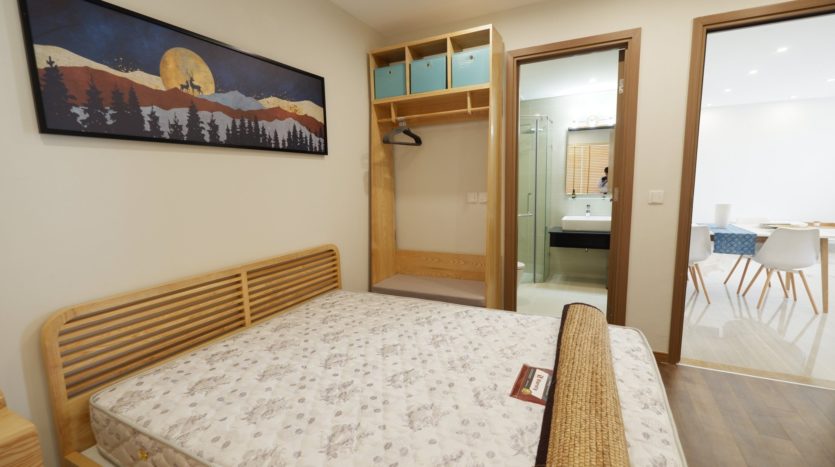
Image resolution: width=835 pixels, height=467 pixels. What are the coordinates of `table runner` in the screenshot? It's located at (734, 243).